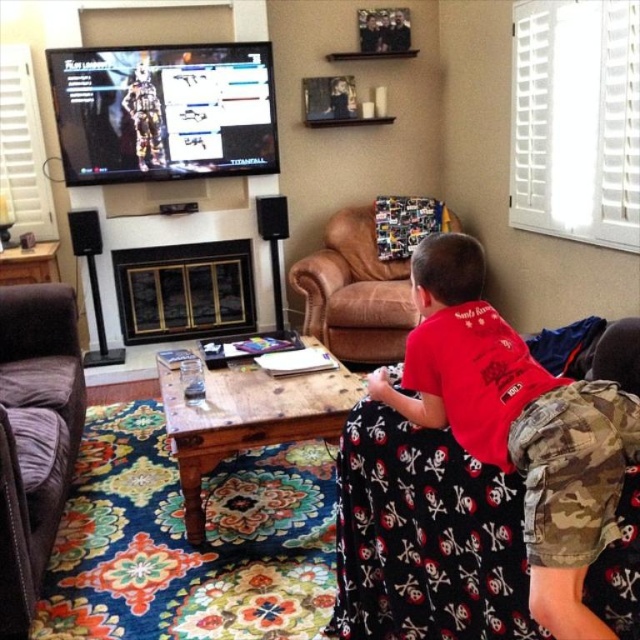
Between red cotton shirt at lower right and brown leather armchair at center, which one is positioned lower?

red cotton shirt at lower right

Is red cotton shirt at lower right taller than brown leather armchair at center?

No, red cotton shirt at lower right is not taller than brown leather armchair at center.

What do you see at coordinates (516, 426) in the screenshot?
I see `red cotton shirt at lower right` at bounding box center [516, 426].

Identify the location of red cotton shirt at lower right. This screenshot has width=640, height=640. (516, 426).

Is metallic gun at upper center taller than brown fabric armchair at lower left?

Incorrect, metallic gun at upper center's height is not larger of brown fabric armchair at lower left's.

Is the position of metallic gun at upper center more distant than that of brown fabric armchair at lower left?

That is True.

The height and width of the screenshot is (640, 640). What do you see at coordinates (163, 112) in the screenshot?
I see `metallic gun at upper center` at bounding box center [163, 112].

Find the location of a particular element. This screenshot has height=640, width=640. metallic gun at upper center is located at coordinates (163, 112).

Which is above, metallic gun at upper center or brown leather armchair at center?

Positioned higher is metallic gun at upper center.

In the scene shown: Does metallic gun at upper center appear under brown leather armchair at center?

No, metallic gun at upper center is not below brown leather armchair at center.

Is point (262, 166) in front of point (330, 307)?

No, (262, 166) is further to viewer.

This screenshot has height=640, width=640. Find the location of `metallic gun at upper center`. metallic gun at upper center is located at coordinates (163, 112).